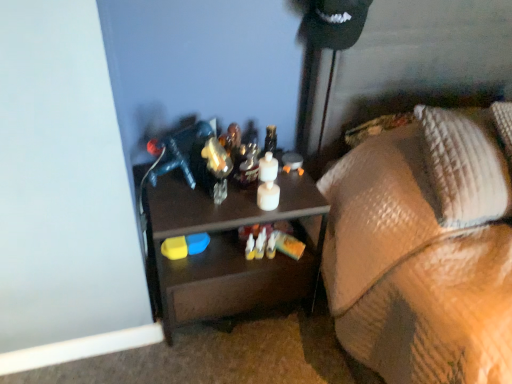
Question: Are textured brown blanket at lower right and brown matte desk at center far apart?

Choices:
 (A) yes
 (B) no

Answer: (B)

Question: Is textured brown blanket at lower right smaller than brown matte desk at center?

Choices:
 (A) no
 (B) yes

Answer: (A)

Question: Does textured brown blanket at lower right turn towards brown matte desk at center?

Choices:
 (A) yes
 (B) no

Answer: (B)

Question: Considering the relative sizes of textured brown blanket at lower right and brown matte desk at center in the image provided, is textured brown blanket at lower right thinner than brown matte desk at center?

Choices:
 (A) no
 (B) yes

Answer: (A)

Question: Is textured brown blanket at lower right to the left of brown matte desk at center from the viewer's perspective?

Choices:
 (A) yes
 (B) no

Answer: (B)

Question: From the image's perspective, relative to brown matte desk at center, is textured brown blanket at lower right above or below?

Choices:
 (A) below
 (B) above

Answer: (B)

Question: Visually, is textured brown blanket at lower right positioned to the left or to the right of brown matte desk at center?

Choices:
 (A) left
 (B) right

Answer: (B)

Question: Is textured brown blanket at lower right spatially inside brown matte desk at center, or outside of it?

Choices:
 (A) outside
 (B) inside

Answer: (A)

Question: Considering the positions of point (364, 273) and point (158, 281), is point (364, 273) closer or farther from the camera than point (158, 281)?

Choices:
 (A) farther
 (B) closer

Answer: (B)

Question: Is brown matte desk at center situated inside woven fabric pillow at right or outside?

Choices:
 (A) outside
 (B) inside

Answer: (A)

Question: From the image's perspective, relative to woven fabric pillow at right, is brown matte desk at center above or below?

Choices:
 (A) above
 (B) below

Answer: (B)

Question: From a real-world perspective, is brown matte desk at center physically located above or below woven fabric pillow at right?

Choices:
 (A) above
 (B) below

Answer: (B)

Question: Relative to woven fabric pillow at right, is brown matte desk at center in front or behind?

Choices:
 (A) behind
 (B) front

Answer: (A)

Question: From the image's perspective, is textured brown blanket at lower right positioned above or below woven fabric pillow at right?

Choices:
 (A) above
 (B) below

Answer: (B)

Question: Which is correct: textured brown blanket at lower right is inside woven fabric pillow at right, or outside of it?

Choices:
 (A) inside
 (B) outside

Answer: (B)